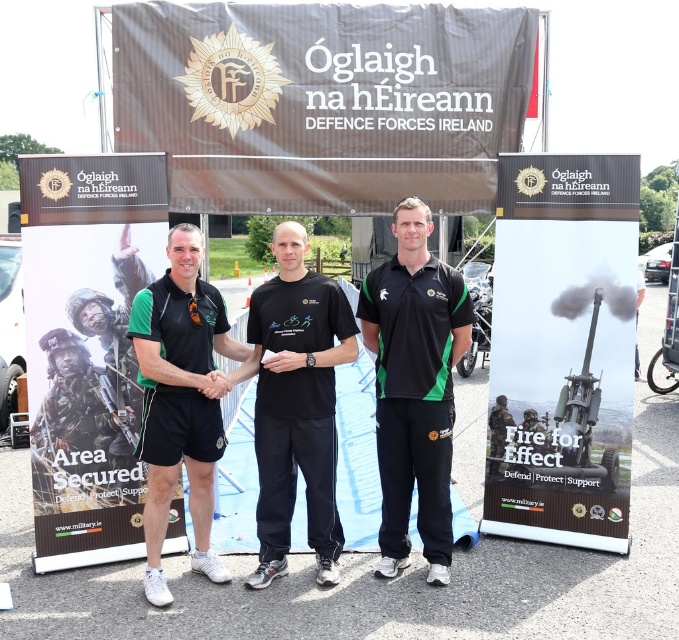
Question: Which point is closer to the camera?

Choices:
 (A) matte black shorts at center
 (B) black matte polo shirt at center

Answer: (A)

Question: Which of these objects is positioned closest to the black matte t-shirt at center?

Choices:
 (A) matte black shorts at center
 (B) black matte polo shirt at center

Answer: (A)

Question: Among these objects, which one is nearest to the camera?

Choices:
 (A) black matte t-shirt at center
 (B) black matte polo shirt at center

Answer: (A)

Question: Is the position of black matte t-shirt at center more distant than that of matte black shorts at center?

Choices:
 (A) yes
 (B) no

Answer: (A)

Question: Does black matte t-shirt at center have a greater width compared to matte black shorts at center?

Choices:
 (A) yes
 (B) no

Answer: (A)

Question: Is black matte polo shirt at center to the left of black matte t-shirt at center from the viewer's perspective?

Choices:
 (A) yes
 (B) no

Answer: (B)